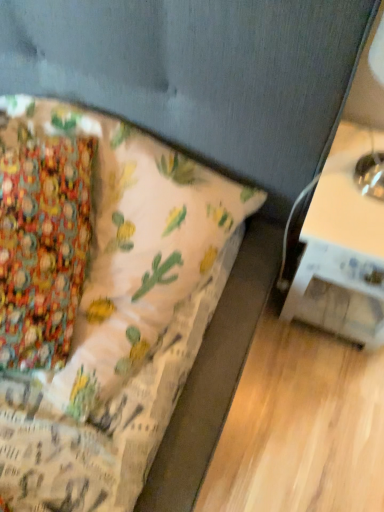
Question: Considering their positions, is textured fabric bed at lower left located in front of or behind white glossy table at right?

Choices:
 (A) behind
 (B) front

Answer: (B)

Question: Is textured fabric bed at lower left taller or shorter than white glossy table at right?

Choices:
 (A) tall
 (B) short

Answer: (B)

Question: Is point (120, 212) positioned closer to the camera than point (359, 298)?

Choices:
 (A) farther
 (B) closer

Answer: (B)

Question: Considering the relative positions of white glossy table at right and textured fabric bed at lower left in the image provided, is white glossy table at right to the left or to the right of textured fabric bed at lower left?

Choices:
 (A) right
 (B) left

Answer: (A)

Question: In terms of width, does white glossy table at right look wider or thinner when compared to textured fabric bed at lower left?

Choices:
 (A) wide
 (B) thin

Answer: (B)

Question: Based on their sizes in the image, would you say white glossy table at right is bigger or smaller than textured fabric bed at lower left?

Choices:
 (A) big
 (B) small

Answer: (B)

Question: From a real-world perspective, is white glossy table at right above or below textured fabric bed at lower left?

Choices:
 (A) above
 (B) below

Answer: (B)